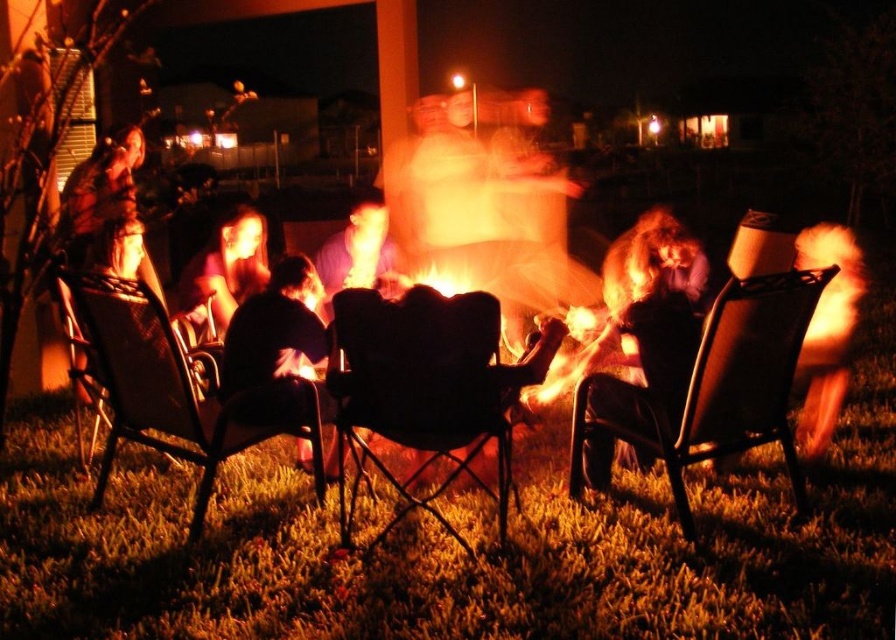
Question: Which point is closer to the camera?

Choices:
 (A) (246, 241)
 (B) (73, 333)

Answer: (B)

Question: Which of the following is the farthest from the observer?

Choices:
 (A) (610, 300)
 (B) (240, 394)
 (C) (515, 500)
 (D) (233, 330)

Answer: (A)

Question: Is metallic black chair at center bigger than black fabric chair at center?

Choices:
 (A) yes
 (B) no

Answer: (B)

Question: Can you confirm if metallic black chair at center is positioned above dark fabric chair at center?

Choices:
 (A) no
 (B) yes

Answer: (A)

Question: Which object is positioned farthest from the metallic black chair at center?

Choices:
 (A) black fabric chair at center
 (B) matte purple shirt at center
 (C) matte black shirt at center
 (D) black leather chair at left

Answer: (D)

Question: Is metallic black chair at left to the left of matte black shirt at center from the viewer's perspective?

Choices:
 (A) yes
 (B) no

Answer: (B)